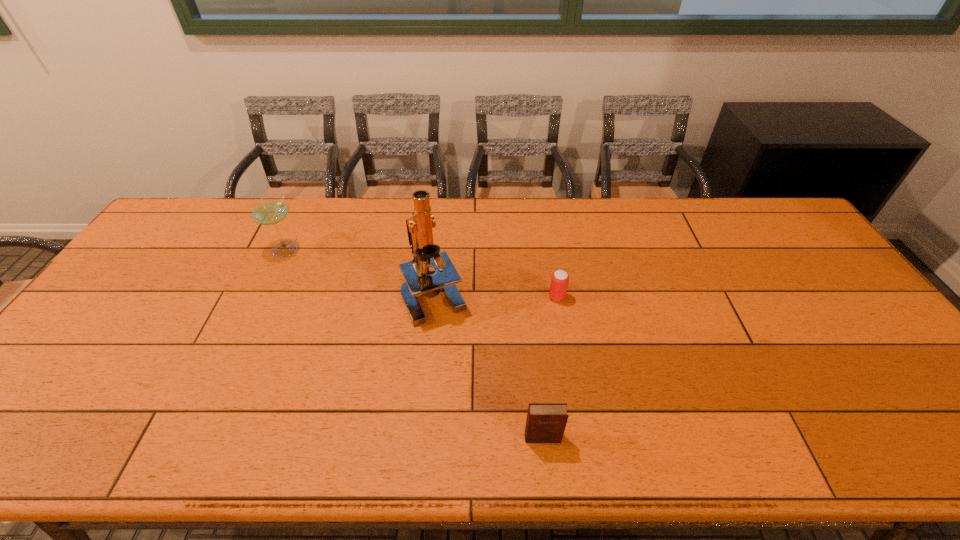
At what (x,y) coordinates should I click in order to perform the action: click on microscope. Please return your answer as a coordinate pair (x, y). The width and height of the screenshot is (960, 540). Looking at the image, I should click on (419, 280).

The height and width of the screenshot is (540, 960). Identify the location of the second object from left to right. (419, 280).

Where is `martini`? The height and width of the screenshot is (540, 960). martini is located at coordinates (268, 211).

Identify the location of the third shortest object. (268, 211).

Find the location of a particular element. Image resolution: width=960 pixels, height=540 pixels. the nearest object is located at coordinates (546, 422).

At what (x,y) coordinates should I click in order to perform the action: click on the second object from right to left. Please return your answer as a coordinate pair (x, y). Looking at the image, I should click on (546, 422).

Locate an element on the screen. Image resolution: width=960 pixels, height=540 pixels. the rightmost object is located at coordinates (559, 282).

Where is `beer can`? Image resolution: width=960 pixels, height=540 pixels. beer can is located at coordinates (559, 282).

Where is `vacant space located at the eyepiece of the third object from right to left`? vacant space located at the eyepiece of the third object from right to left is located at coordinates (425, 382).

Identify the location of free region located 0.240m on the right of the third shortest object. The width and height of the screenshot is (960, 540). (377, 250).